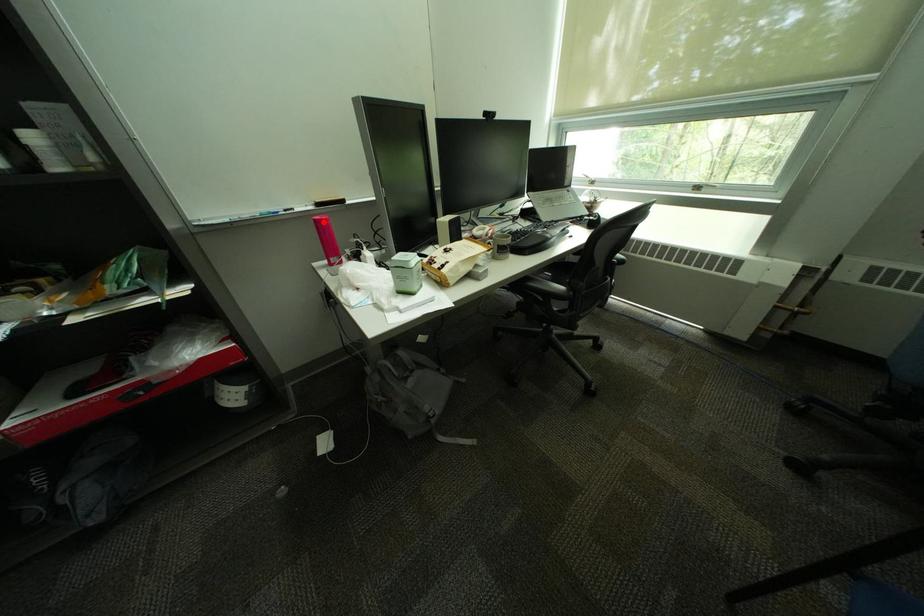
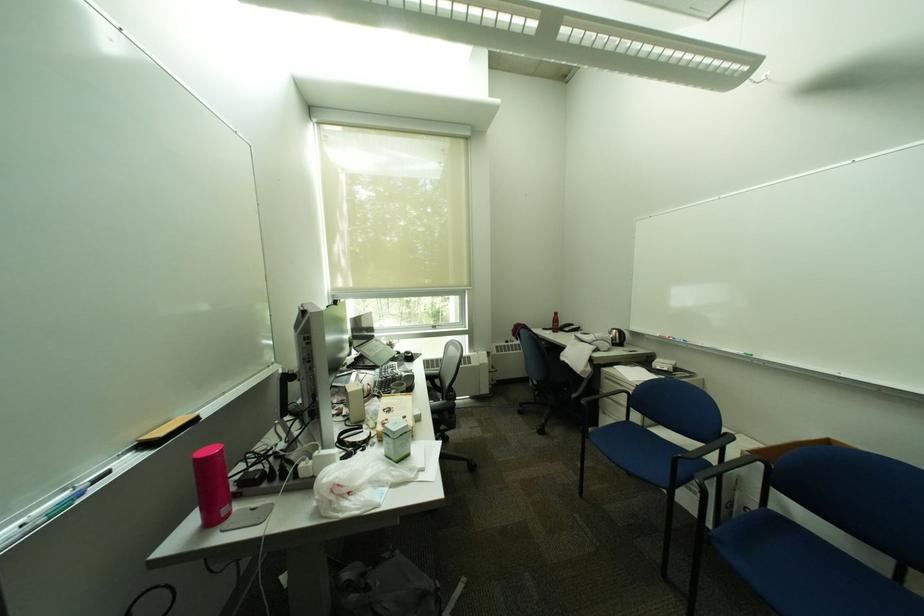
The point at the highlighted location is marked in the first image. Where is the corresponding point in the second image?

(202, 464)